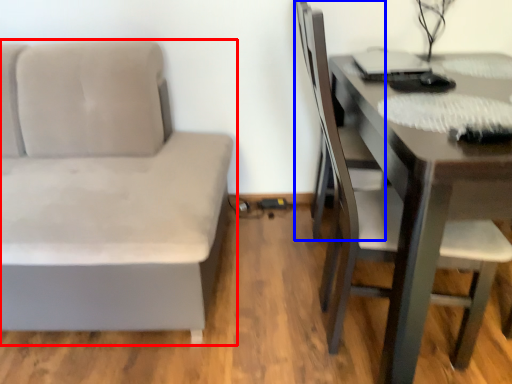
Question: Which object appears farthest to the camera in this image, studio couch (highlighted by a red box) or swivel chair (highlighted by a blue box)?

Choices:
 (A) studio couch
 (B) swivel chair

Answer: (B)